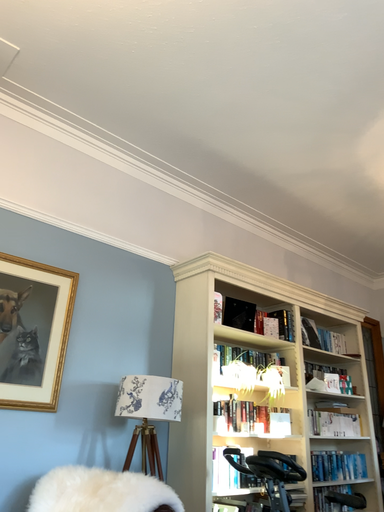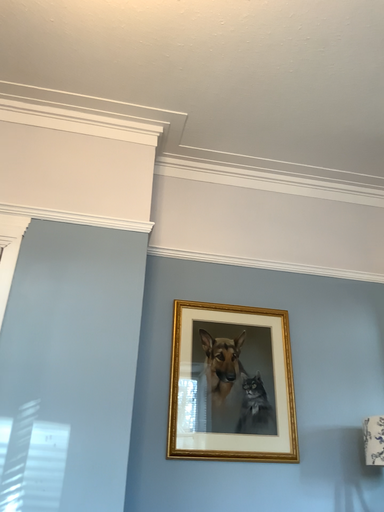
Question: How did the camera likely rotate when shooting the video?

Choices:
 (A) rotated left
 (B) rotated right

Answer: (A)